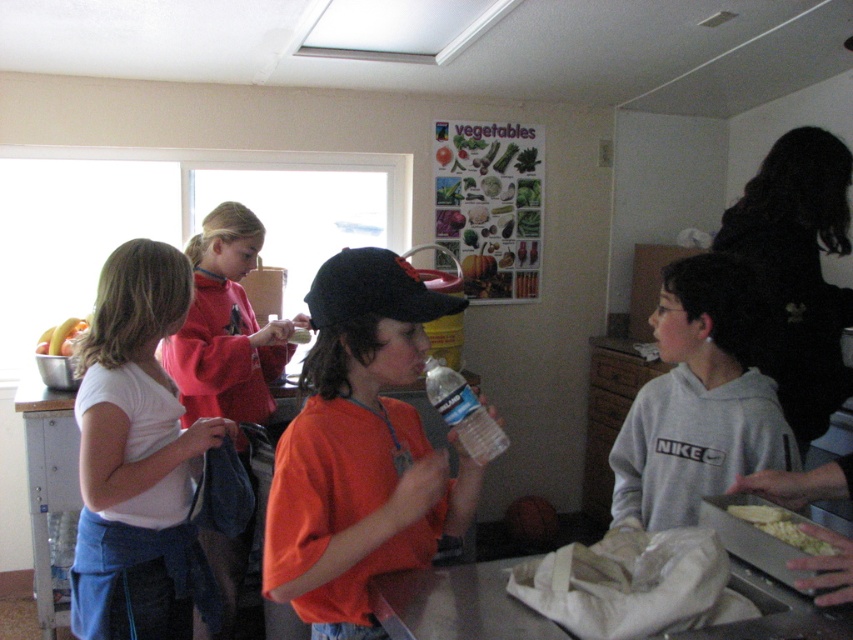
Does gray fleece hoodie at right have a greater height compared to yellowish matte corn at lower right?

Yes.

Is point (695, 291) less distant than point (804, 538)?

No, (695, 291) is further to viewer.

At what (x,y) coordinates should I click in order to perform the action: click on gray fleece hoodie at right. Please return your answer as a coordinate pair (x, y). The width and height of the screenshot is (853, 640). Looking at the image, I should click on (698, 401).

Can you confirm if white plastic exhaust hood at upper center is thinner than yellow plastic bag at lower left?

No, white plastic exhaust hood at upper center is not thinner than yellow plastic bag at lower left.

This screenshot has width=853, height=640. What do you see at coordinates (399, 28) in the screenshot?
I see `white plastic exhaust hood at upper center` at bounding box center [399, 28].

Image resolution: width=853 pixels, height=640 pixels. I want to click on white plastic exhaust hood at upper center, so click(x=399, y=28).

Is black fabric at right wider than white plastic exhaust hood at upper center?

In fact, black fabric at right might be narrower than white plastic exhaust hood at upper center.

Is black fabric at right bigger than white plastic exhaust hood at upper center?

Correct, black fabric at right is larger in size than white plastic exhaust hood at upper center.

Locate an element on the screen. black fabric at right is located at coordinates tap(798, 272).

Where is `black fabric at right`? This screenshot has width=853, height=640. black fabric at right is located at coordinates pyautogui.click(x=798, y=272).